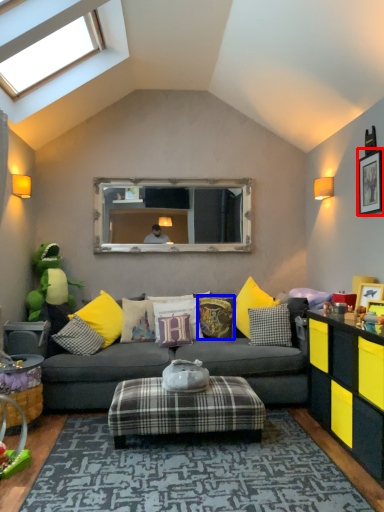
Question: Which of the following is the farthest to the observer, picture frame (highlighted by a red box) or pillow (highlighted by a blue box)?

Choices:
 (A) picture frame
 (B) pillow

Answer: (B)